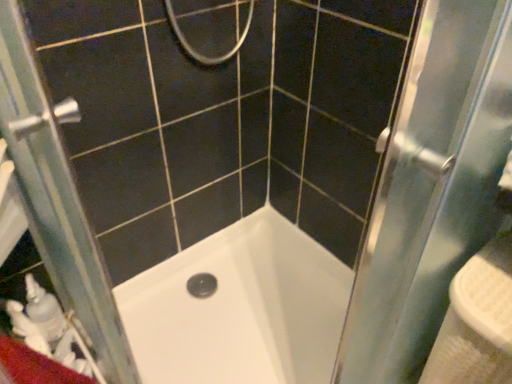
Question: Should I look upward or downward to see clear glass screen door at left?

Choices:
 (A) down
 (B) up

Answer: (A)

Question: Considering the relative positions of white plastic sink at right and white glossy bathtub at center in the image provided, is white plastic sink at right to the left of white glossy bathtub at center from the viewer's perspective?

Choices:
 (A) no
 (B) yes

Answer: (A)

Question: Can you confirm if white plastic sink at right is taller than white glossy bathtub at center?

Choices:
 (A) no
 (B) yes

Answer: (B)

Question: From a real-world perspective, is white plastic sink at right under white glossy bathtub at center?

Choices:
 (A) yes
 (B) no

Answer: (B)

Question: Considering the relative sizes of white plastic sink at right and white glossy bathtub at center in the image provided, is white plastic sink at right wider than white glossy bathtub at center?

Choices:
 (A) no
 (B) yes

Answer: (A)

Question: Is white plastic sink at right turned away from white glossy bathtub at center?

Choices:
 (A) yes
 (B) no

Answer: (B)

Question: Would you say white plastic sink at right contains white glossy bathtub at center?

Choices:
 (A) yes
 (B) no

Answer: (B)

Question: From the image's perspective, is clear glass screen door at left beneath white glossy bathtub at center?

Choices:
 (A) yes
 (B) no

Answer: (B)

Question: Is clear glass screen door at left bigger than white glossy bathtub at center?

Choices:
 (A) yes
 (B) no

Answer: (B)

Question: Is clear glass screen door at left positioned behind white glossy bathtub at center?

Choices:
 (A) yes
 (B) no

Answer: (B)

Question: Can you confirm if clear glass screen door at left is thinner than white glossy bathtub at center?

Choices:
 (A) no
 (B) yes

Answer: (B)

Question: Is clear glass screen door at left positioned with its back to white glossy bathtub at center?

Choices:
 (A) no
 (B) yes

Answer: (B)

Question: Considering the relative sizes of clear glass screen door at left and white glossy bathtub at center in the image provided, is clear glass screen door at left smaller than white glossy bathtub at center?

Choices:
 (A) no
 (B) yes

Answer: (B)

Question: From the image's perspective, is white plastic sink at right on top of clear glass screen door at left?

Choices:
 (A) yes
 (B) no

Answer: (B)